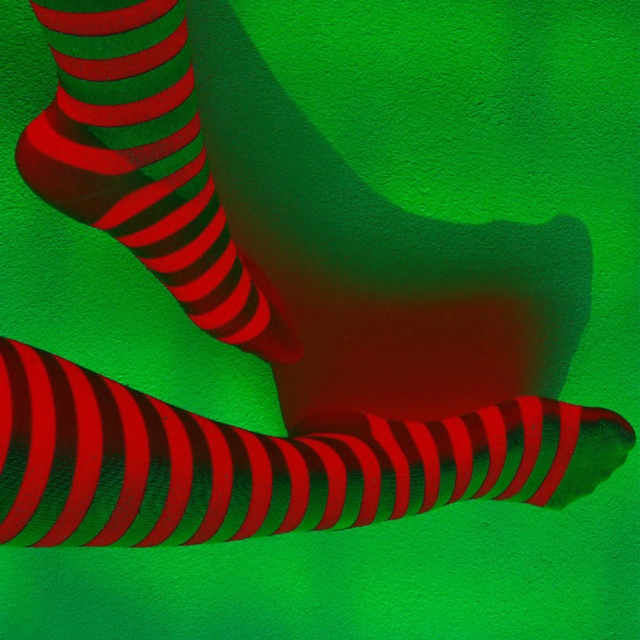
Based on the photo, you are an observer looking at the legs in the image. Which object is positioned to the right side of the other between the shiny metallic sock at lower center and the shiny metallic socks at upper left?

The shiny metallic sock at lower center is positioned to the right of the shiny metallic socks at upper left.